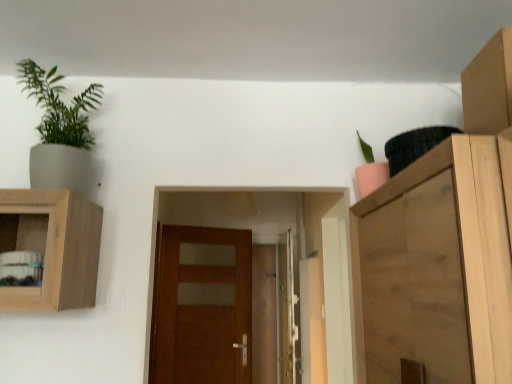
Question: From a real-world perspective, is cardboard box at upper right positioned over pink matte pot at upper right, the first houseplant viewed from the right, based on gravity?

Choices:
 (A) yes
 (B) no

Answer: (A)

Question: Is cardboard box at upper right next to pink matte pot at upper right, the first houseplant viewed from the right?

Choices:
 (A) yes
 (B) no

Answer: (B)

Question: From the image's perspective, is cardboard box at upper right beneath pink matte pot at upper right, the first houseplant viewed from the right?

Choices:
 (A) yes
 (B) no

Answer: (B)

Question: Can you confirm if cardboard box at upper right is positioned to the right of pink matte pot at upper right, the 2th houseplant when ordered from left to right?

Choices:
 (A) yes
 (B) no

Answer: (A)

Question: Is cardboard box at upper right aimed at pink matte pot at upper right, the 2th houseplant when ordered from left to right?

Choices:
 (A) no
 (B) yes

Answer: (A)

Question: Is cardboard box at upper right bigger or smaller than matte gray pot at upper left, marked as the first houseplant in a left-to-right arrangement?

Choices:
 (A) small
 (B) big

Answer: (A)

Question: Considering the positions of cardboard box at upper right and matte gray pot at upper left, the second houseplant from the right, in the image, is cardboard box at upper right taller or shorter than matte gray pot at upper left, the second houseplant from the right,?

Choices:
 (A) tall
 (B) short

Answer: (B)

Question: Is point (507, 61) positioned closer to the camera than point (83, 130)?

Choices:
 (A) closer
 (B) farther

Answer: (A)

Question: Looking at their shapes, would you say cardboard box at upper right is wider or thinner than matte gray pot at upper left, the second houseplant from the right?

Choices:
 (A) thin
 (B) wide

Answer: (A)

Question: Considering the positions of point (500, 96) and point (283, 259), is point (500, 96) closer or farther from the camera than point (283, 259)?

Choices:
 (A) farther
 (B) closer

Answer: (B)

Question: Based on their sizes in the image, would you say cardboard box at upper right is bigger or smaller than metallic silver screen door at center?

Choices:
 (A) small
 (B) big

Answer: (A)

Question: Is cardboard box at upper right in front of or behind metallic silver screen door at center in the image?

Choices:
 (A) behind
 (B) front

Answer: (B)

Question: Is cardboard box at upper right wider or thinner than metallic silver screen door at center?

Choices:
 (A) wide
 (B) thin

Answer: (A)

Question: Would you say wooden cabinet at right is inside or outside brown wooden door at center, which ranks as the 1th door in front-to-back order?

Choices:
 (A) inside
 (B) outside

Answer: (B)

Question: Does point (495, 200) appear closer or farther from the camera than point (172, 288)?

Choices:
 (A) closer
 (B) farther

Answer: (A)